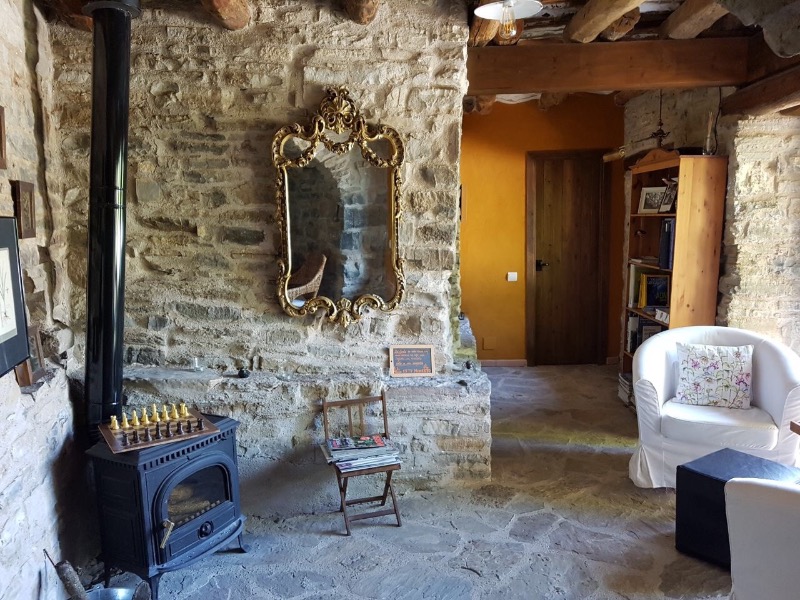
I want to click on softcover magazine, so click(x=365, y=448).